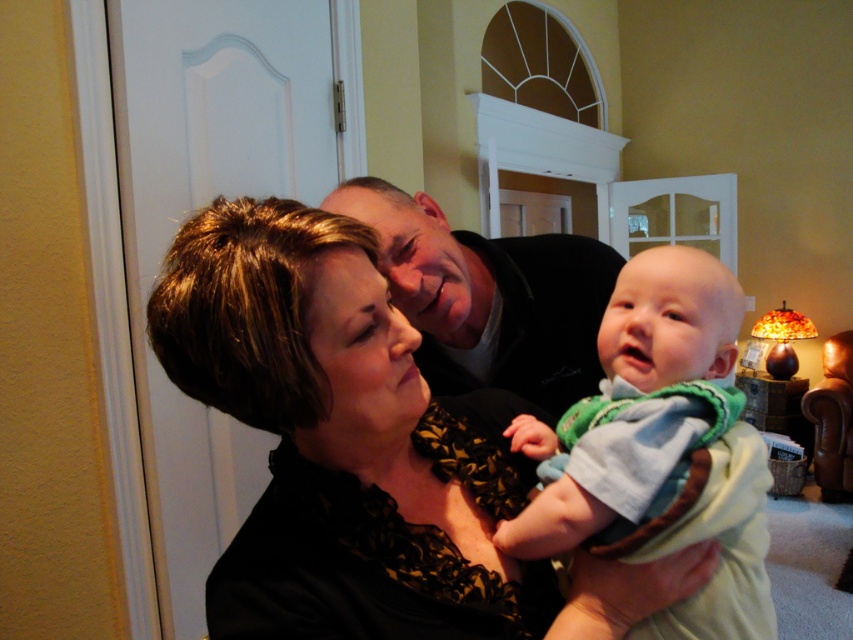
Question: Where is black lace blouse at center located in relation to soft green knit sweater at center in the image?

Choices:
 (A) right
 (B) left

Answer: (B)

Question: Among these objects, which one is nearest to the camera?

Choices:
 (A) soft green knit sweater at center
 (B) smooth black shirt at center

Answer: (A)

Question: Which object is farther from the camera taking this photo?

Choices:
 (A) smooth black shirt at center
 (B) soft green knit sweater at center

Answer: (A)

Question: Does black lace blouse at center come behind smooth black shirt at center?

Choices:
 (A) no
 (B) yes

Answer: (A)

Question: Is black lace blouse at center bigger than smooth black shirt at center?

Choices:
 (A) no
 (B) yes

Answer: (B)

Question: Which object appears closest to the camera in this image?

Choices:
 (A) smooth black shirt at center
 (B) black lace blouse at center
 (C) soft green knit sweater at center

Answer: (B)